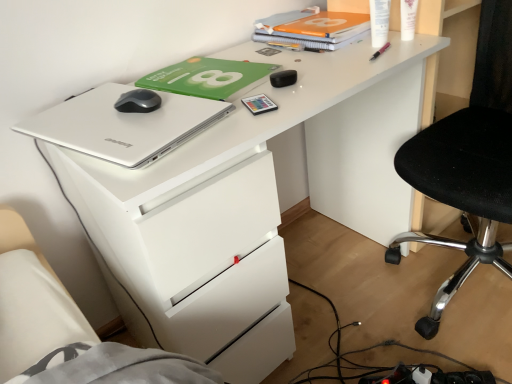
You are a GUI agent. You are given a task and a screenshot of the screen. Output one action in this format:
    pyautogui.click(x=<x>, y=<y>)
    Task: Click on the unoccupied region to the right of black matte earbuds at center, the second stationery ordered from the bottom
    
    Given the screenshot: What is the action you would take?
    pyautogui.click(x=338, y=69)